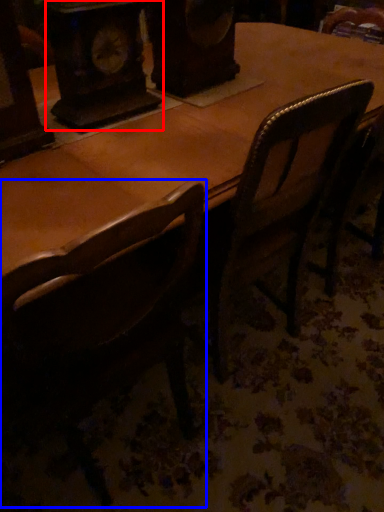
Question: Which point is closer to the camera, clock (highlighted by a red box) or chair (highlighted by a blue box)?

Choices:
 (A) clock
 (B) chair

Answer: (B)